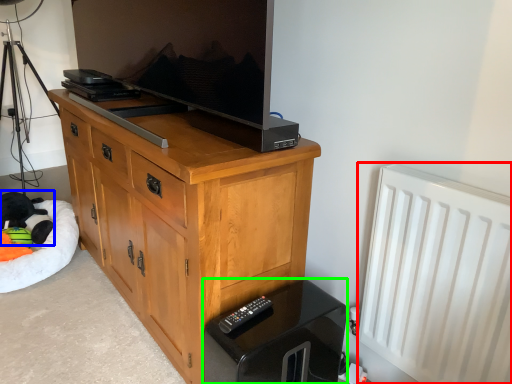
Question: Based on their relative distances, which object is farther from radiator (highlighted by a red box)? Choose from animal (highlighted by a blue box) and vanity (highlighted by a green box).

Choices:
 (A) animal
 (B) vanity

Answer: (A)